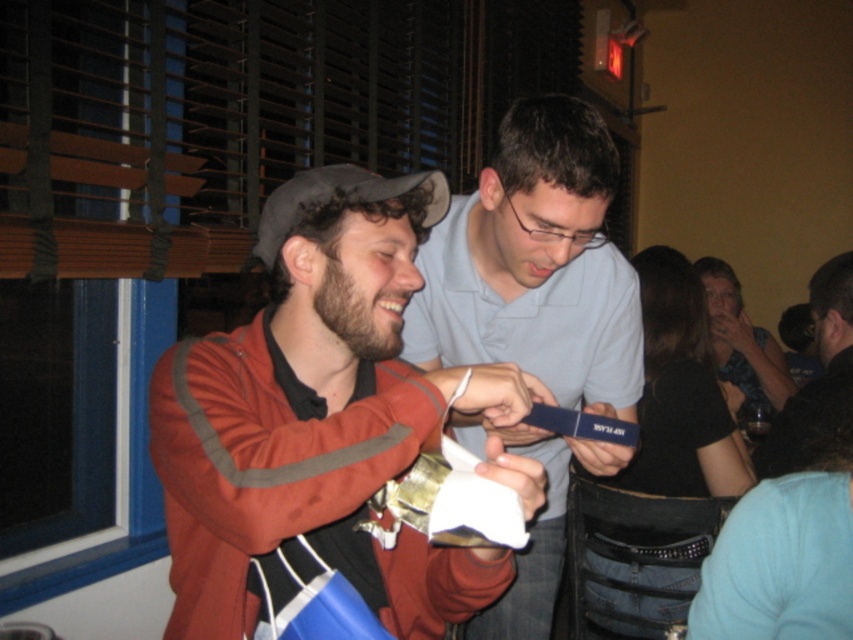
You are at a party and see the matte brown cap at upper left and the matte black phone at right. Which object is located more to the left?

The matte brown cap at upper left is positioned more to the left than the matte black phone at right.

Consider the image. You are at a party and want to take a photo of both people holding items. The first person is at point (526, 557) and the second at (718, 342). Which person should you focus on first to ensure both are in focus?

You should focus on the person at point (526, 557) first because they are closer to the camera. Since they are closer, focusing on them will help ensure the second person at (718, 342) is also in focus as they are further away.

You are standing at the origin of the coordinate system in the image. Which of the two points, point (326, 436) or point (753, 337), is closer to you?

Point (326, 436) is in front of point (753, 337), so it is closer to you.